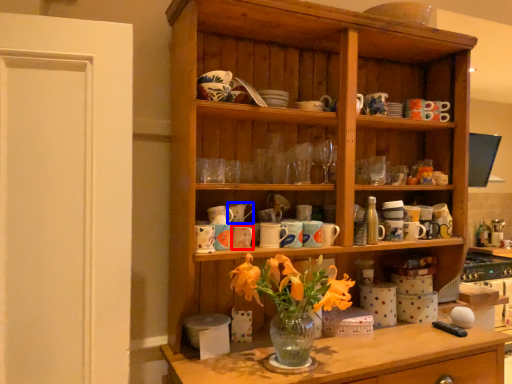
Question: Which point is further to the camera, tableware (highlighted by a red box) or tableware (highlighted by a blue box)?

Choices:
 (A) tableware
 (B) tableware

Answer: (B)